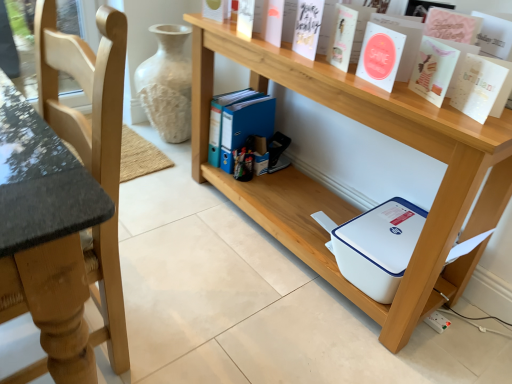
Question: Is white matte paper at upper center, which ranks as the second paperback book in left-to-right order, turned away from white plastic printer at lower center?

Choices:
 (A) no
 (B) yes

Answer: (A)

Question: Can you confirm if white matte paper at upper center, the fourth paperback book viewed from the right, is wider than white plastic printer at lower center?

Choices:
 (A) yes
 (B) no

Answer: (B)

Question: Can you confirm if white matte paper at upper center, which ranks as the second paperback book in left-to-right order, is shorter than white plastic printer at lower center?

Choices:
 (A) no
 (B) yes

Answer: (B)

Question: Considering the relative sizes of white matte paper at upper center, which ranks as the second paperback book in left-to-right order, and white plastic printer at lower center in the image provided, is white matte paper at upper center, which ranks as the second paperback book in left-to-right order, bigger than white plastic printer at lower center?

Choices:
 (A) yes
 (B) no

Answer: (B)

Question: From the image's perspective, does white matte paper at upper center, which ranks as the second paperback book in left-to-right order, appear lower than white plastic printer at lower center?

Choices:
 (A) yes
 (B) no

Answer: (B)

Question: Can you confirm if white matte paper at upper center, which ranks as the second paperback book in left-to-right order, is smaller than white plastic printer at lower center?

Choices:
 (A) yes
 (B) no

Answer: (A)

Question: From the image's perspective, is light wood chair at left located beneath white plastic printer at lower center?

Choices:
 (A) yes
 (B) no

Answer: (A)

Question: Is light wood chair at left looking in the opposite direction of white plastic printer at lower center?

Choices:
 (A) no
 (B) yes

Answer: (B)

Question: Does light wood chair at left have a smaller size compared to white plastic printer at lower center?

Choices:
 (A) no
 (B) yes

Answer: (B)

Question: Is white plastic printer at lower center completely or partially inside light wood chair at left?

Choices:
 (A) no
 (B) yes

Answer: (A)

Question: From a real-world perspective, is light wood chair at left located higher than white plastic printer at lower center?

Choices:
 (A) no
 (B) yes

Answer: (B)

Question: Is the position of light wood chair at left less distant than that of white plastic printer at lower center?

Choices:
 (A) yes
 (B) no

Answer: (A)

Question: Can you confirm if white plastic printer at lower center is positioned to the left of light wood chair at left?

Choices:
 (A) no
 (B) yes

Answer: (A)